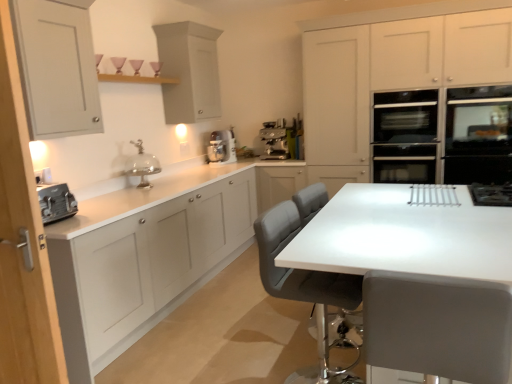
Question: Choose the correct answer: Is matte gray chair at center, arranged as the 1th chair when viewed from the front, inside gray leather chair at center, marked as the 1th chair in a back-to-front arrangement, or outside it?

Choices:
 (A) outside
 (B) inside

Answer: (A)

Question: From a real-world perspective, is matte gray chair at center, the second chair from the back, positioned above or below gray leather chair at center, positioned as the 2th chair in front-to-back order?

Choices:
 (A) above
 (B) below

Answer: (A)

Question: Considering the real-world distances, which object is closest to the matte gray chair at center, the second chair from the back?

Choices:
 (A) matte white mixer at center
 (B) white glossy table at center
 (C) white matte cabinet at upper center, arranged as the 2th cabinetry when viewed from the right
 (D) gray leather chair at center, positioned as the 2th chair in front-to-back order
 (E) black glass oven at right, which is the first oven in left-to-right order

Answer: (B)

Question: Estimate the real-world distances between objects in this image. Which object is closer to the black glass oven at right, arranged as the 2th oven when viewed from the right?

Choices:
 (A) matte white mixer at center
 (B) white matte cabinetry at right, positioned as the fifth cabinetry in left-to-right order
 (C) gray leather chair at center, positioned as the 2th chair in front-to-back order
 (D) black glass oven at right, acting as the first oven starting from the right
 (E) white matte cabinet at left, positioned as the 3th cabinetry in left-to-right order

Answer: (D)